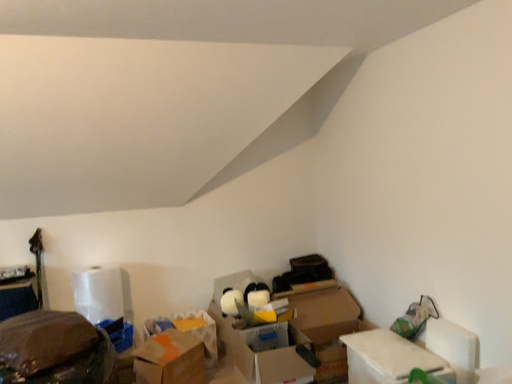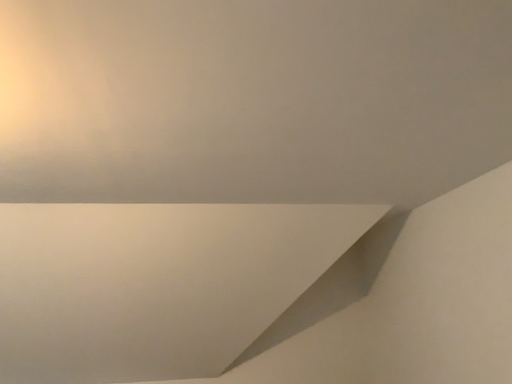
Question: Which way did the camera rotate in the video?

Choices:
 (A) rotated left
 (B) rotated right

Answer: (A)